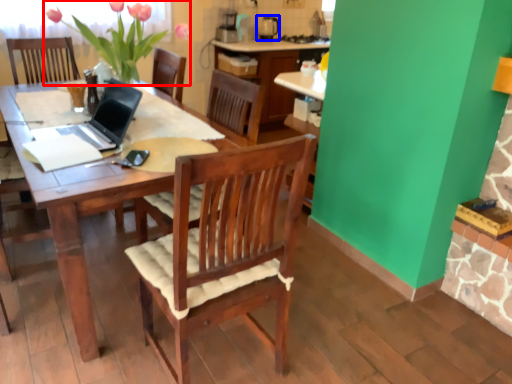
Question: Which of the following is the farthest to the observer, floral arrangement (highlighted by a red box) or appliance (highlighted by a blue box)?

Choices:
 (A) floral arrangement
 (B) appliance

Answer: (B)